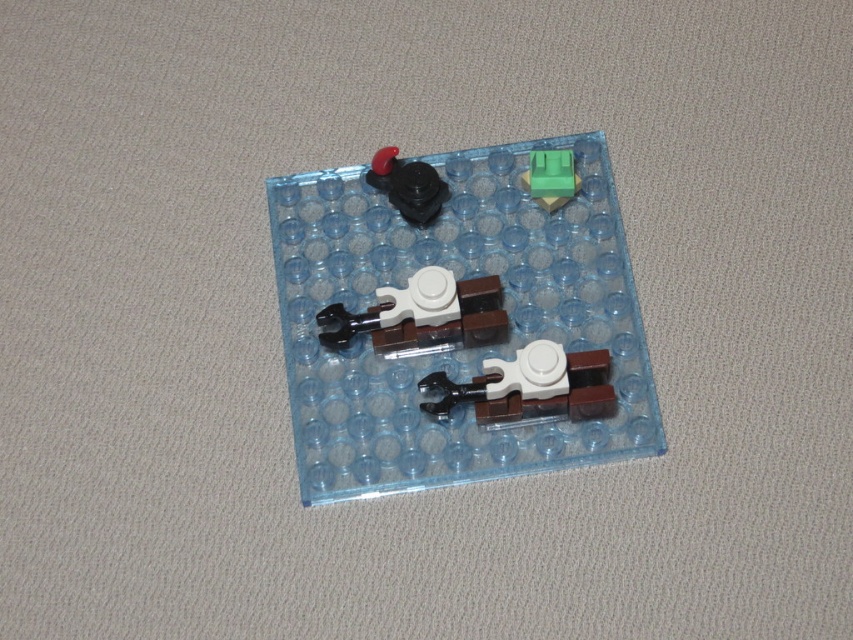
Is brown matte/brick-like at center thinner than green plastic block at upper right?

Incorrect, brown matte/brick-like at center's width is not less than green plastic block at upper right's.

Can you confirm if brown matte/brick-like at center is bigger than green plastic block at upper right?

Yes.

Is point (451, 304) positioned before point (537, 193)?

Yes, point (451, 304) is closer to viewer.

Identify the location of brown matte/brick-like at center. (422, 316).

Between brown plastic train at center and green plastic block at upper right, which one appears on the right side from the viewer's perspective?

green plastic block at upper right is more to the right.

Does brown plastic train at center appear under green plastic block at upper right?

Yes.

Which is in front, point (527, 465) or point (560, 202)?

Point (527, 465)

The image size is (853, 640). In order to click on brown plastic train at center in this screenshot , I will do `click(459, 323)`.

Does matte black gear at upper left have a greater width compared to green plastic block at upper right?

Yes.

Who is taller, matte black gear at upper left or green plastic block at upper right?

matte black gear at upper left is taller.

Who is more distant from viewer, (x=409, y=189) or (x=556, y=179)?

Positioned behind is point (x=556, y=179).

The width and height of the screenshot is (853, 640). Identify the location of matte black gear at upper left. (407, 186).